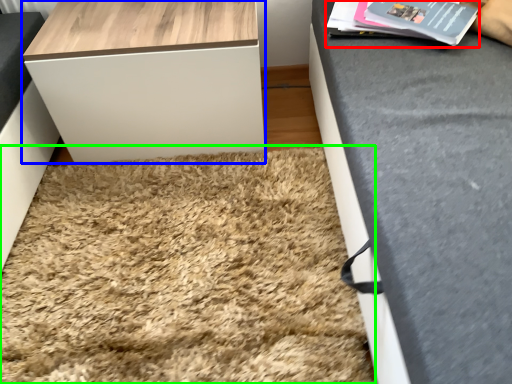
Question: Which object is positioned closest to magazine (highlighted by a red box)? Select from table (highlighted by a blue box) and mat (highlighted by a green box).

Choices:
 (A) table
 (B) mat

Answer: (A)